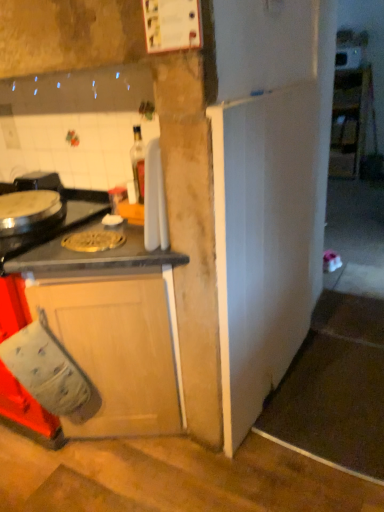
Question: Is white glossy cabinet at upper right, placed as the second cabinetry when sorted from bottom to top, located within gold metallic pizza pan at center?

Choices:
 (A) no
 (B) yes

Answer: (A)

Question: From a real-world perspective, is gold metallic pizza pan at center located beneath white glossy cabinet at upper right, acting as the 1th cabinetry starting from the back?

Choices:
 (A) yes
 (B) no

Answer: (B)

Question: Does gold metallic pizza pan at center have a lesser width compared to white glossy cabinet at upper right, marked as the 1th cabinetry in a right-to-left arrangement?

Choices:
 (A) no
 (B) yes

Answer: (B)

Question: Considering the relative positions of gold metallic pizza pan at center and white glossy cabinet at upper right, placed as the second cabinetry when sorted from bottom to top, in the image provided, is gold metallic pizza pan at center to the left of white glossy cabinet at upper right, placed as the second cabinetry when sorted from bottom to top, from the viewer's perspective?

Choices:
 (A) no
 (B) yes

Answer: (B)

Question: Is gold metallic pizza pan at center positioned with its back to white glossy cabinet at upper right, placed as the second cabinetry when sorted from bottom to top?

Choices:
 (A) yes
 (B) no

Answer: (A)

Question: Is gold metallic pizza pan at center bigger than white glossy cabinet at upper right, acting as the 1th cabinetry starting from the back?

Choices:
 (A) no
 (B) yes

Answer: (A)

Question: Is white glossy cabinet at upper right, acting as the 1th cabinetry starting from the back, in contact with gold metallic pizza pan at center?

Choices:
 (A) no
 (B) yes

Answer: (A)

Question: Is white glossy cabinet at upper right, marked as the 1th cabinetry in a right-to-left arrangement, oriented towards gold metallic pizza pan at center?

Choices:
 (A) yes
 (B) no

Answer: (A)

Question: Considering the relative sizes of white glossy cabinet at upper right, marked as the 1th cabinetry in a right-to-left arrangement, and gold metallic pizza pan at center in the image provided, is white glossy cabinet at upper right, marked as the 1th cabinetry in a right-to-left arrangement, taller than gold metallic pizza pan at center?

Choices:
 (A) yes
 (B) no

Answer: (A)

Question: From a real-world perspective, is white glossy cabinet at upper right, placed as the second cabinetry when sorted from bottom to top, located higher than gold metallic pizza pan at center?

Choices:
 (A) no
 (B) yes

Answer: (A)

Question: Considering the relative sizes of white glossy cabinet at upper right, marked as the 1th cabinetry in a right-to-left arrangement, and gold metallic pizza pan at center in the image provided, is white glossy cabinet at upper right, marked as the 1th cabinetry in a right-to-left arrangement, thinner than gold metallic pizza pan at center?

Choices:
 (A) yes
 (B) no

Answer: (B)

Question: From the image's perspective, does white glossy cabinet at upper right, marked as the 1th cabinetry in a right-to-left arrangement, appear lower than gold metallic pizza pan at center?

Choices:
 (A) no
 (B) yes

Answer: (A)

Question: Is white glossy cabinet at upper right, the first cabinetry positioned from the top, outside shiny metallic burner at left?

Choices:
 (A) yes
 (B) no

Answer: (A)